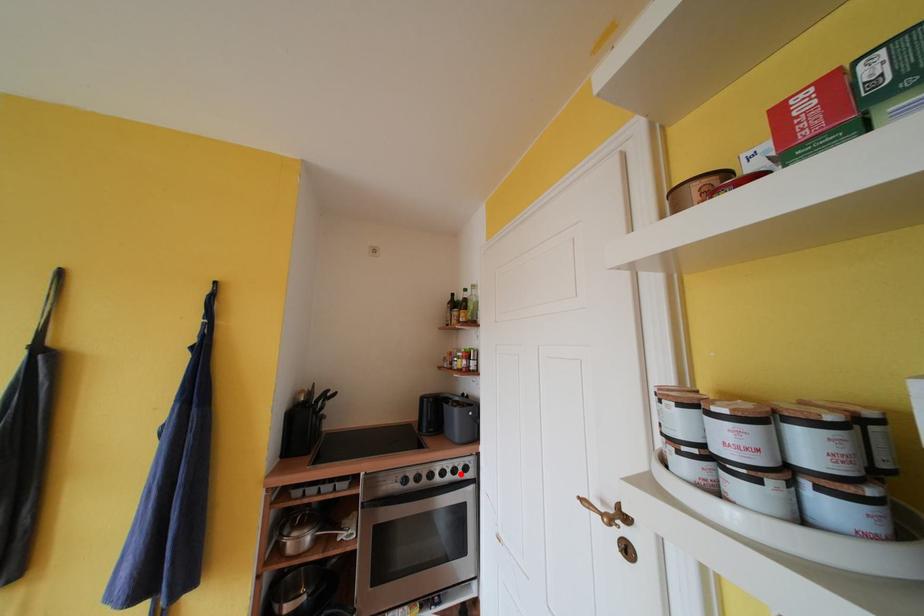
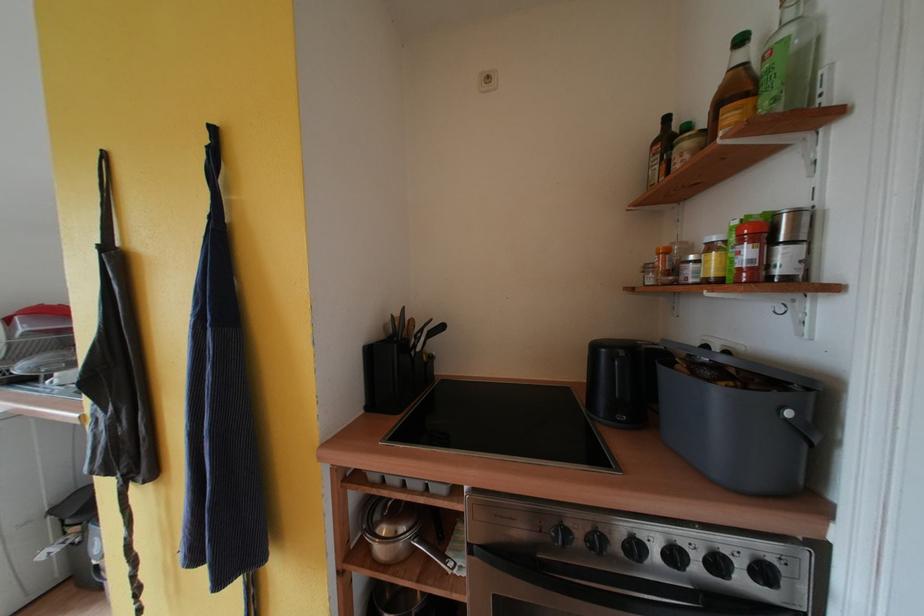
The point at the highlighted location is marked in the first image. Where is the corresponding point in the second image?

(723, 567)